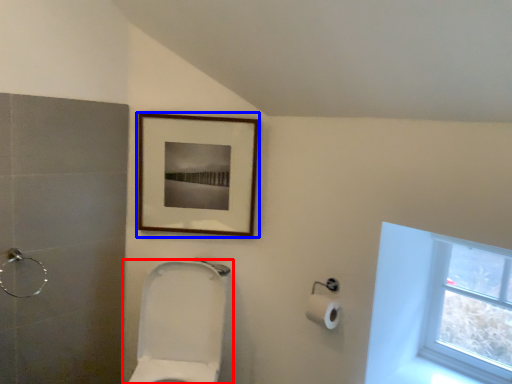
Question: Which object appears closest to the camera in this image, toilet (highlighted by a red box) or picture frame (highlighted by a blue box)?

Choices:
 (A) toilet
 (B) picture frame

Answer: (A)